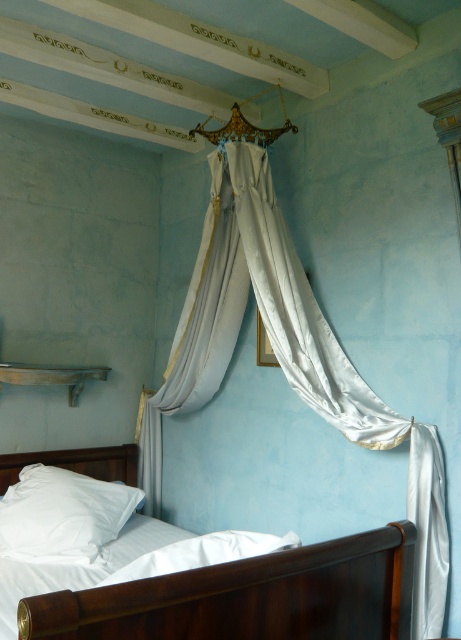
From the picture: You are an interior designer planning to hang a new painting in the bedroom. The painting is 0.6 meters wide and needs to be placed exactly at the coordinates where the satin white curtain at upper center is located. Given the room dimensions, will the painting fit without overlapping the curtain?

The satin white curtain at upper center is positioned at point coordinates [288,356]. Since the painting is 0.6 meters wide, it will overlap the curtain unless adjusted. Therefore, the painting cannot be placed there without overlapping the curtain.

You are standing at the entrance of the bedroom and want to walk directly towards the satin white bed at upper center. Given that the room is 3 meters wide and 4 meters long, and your starting position is at the bottom left corner, can you reach the bed without deviating from a straight path?

The satin white bed at upper center is located at point coordinates that would require a straight path from the bottom left corner. Since the room dimensions are 3 meters wide and 4 meters long, the coordinates suggest the bed is positioned such that a straight path is possible. Therefore, you can reach the bed without deviating from a straight path.